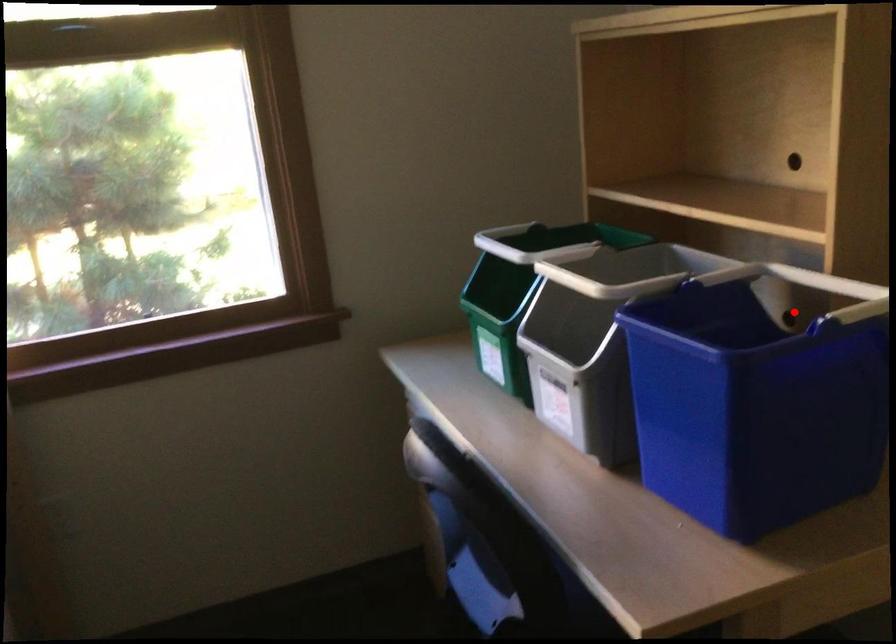
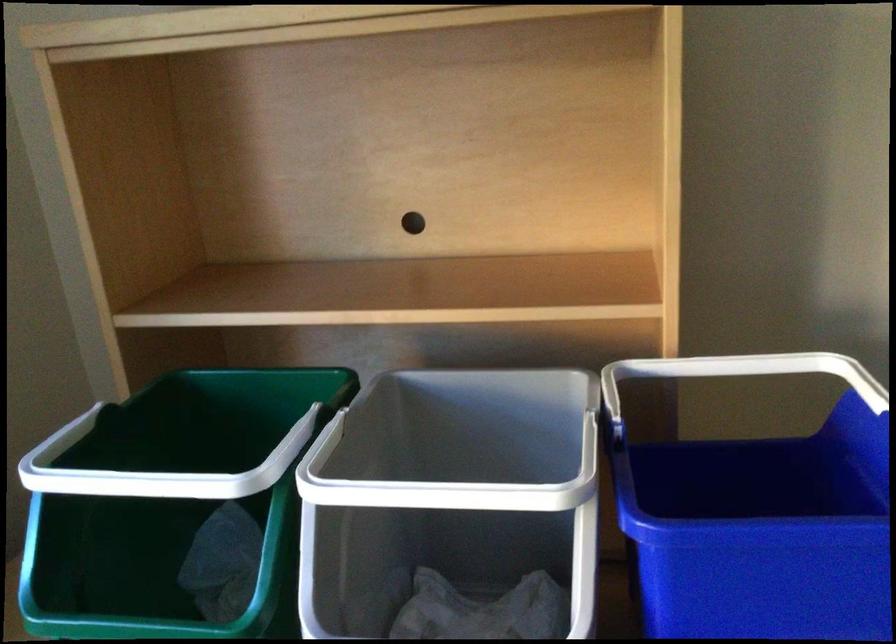
Question: I am providing you with two images of the same scene from different viewpoints. A red point is marked on the first image. Is the red point's position out of view in image 2?

Choices:
 (A) Yes
 (B) No

Answer: (A)